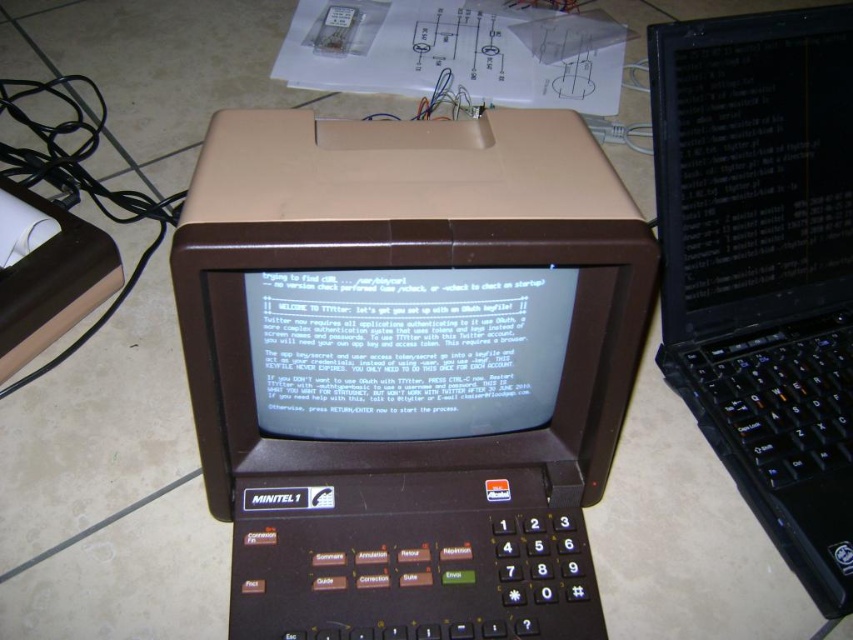
Question: Considering the relative positions of brown plastic minitel 1 at center and black glossy laptop at upper right in the image provided, where is brown plastic minitel 1 at center located with respect to black glossy laptop at upper right?

Choices:
 (A) left
 (B) right

Answer: (A)

Question: Which point appears closest to the camera in this image?

Choices:
 (A) (294, 154)
 (B) (665, 148)

Answer: (A)

Question: Which point is farther to the camera?

Choices:
 (A) black glossy laptop at upper right
 (B) brown plastic minitel 1 at center

Answer: (A)

Question: Is brown plastic minitel 1 at center bigger than black glossy laptop at upper right?

Choices:
 (A) no
 (B) yes

Answer: (A)

Question: Which point is closer to the camera?

Choices:
 (A) (775, 221)
 (B) (445, 419)

Answer: (B)

Question: Does brown plastic minitel 1 at center have a lesser width compared to black glossy laptop at upper right?

Choices:
 (A) no
 (B) yes

Answer: (A)